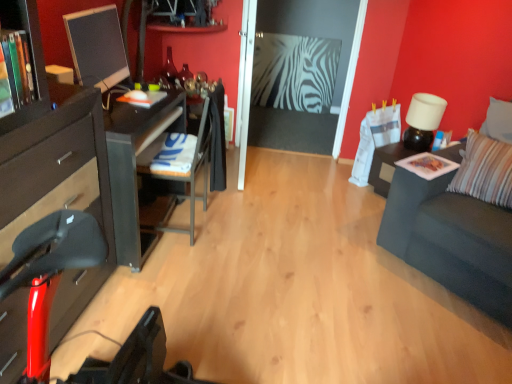
In order to click on blank space situated above white matte lamp at upper right (from a real-world perspective) in this screenshot , I will do `click(430, 98)`.